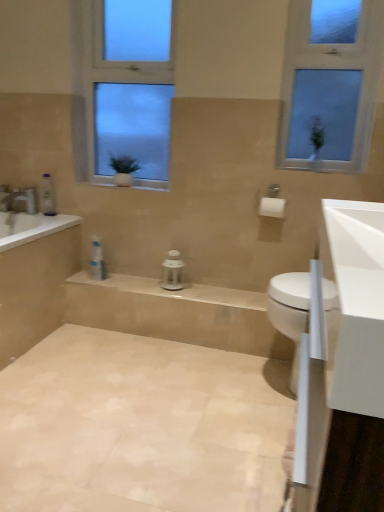
Question: Which is correct: white matte toilet paper at upper center is inside white glossy bathtub at left, or outside of it?

Choices:
 (A) inside
 (B) outside

Answer: (B)

Question: Is white matte toilet paper at upper center bigger or smaller than white glossy bathtub at left?

Choices:
 (A) big
 (B) small

Answer: (B)

Question: Estimate the real-world distances between objects in this image. Which object is farther from the clear glass window at center, acting as the 1th window starting from the left?

Choices:
 (A) clear plastic bottle at left, the first toiletry in the top-to-bottom sequence
 (B) beige tile bath at lower left
 (C) white glossy sink at right
 (D) clear glass window at upper right, the 1th window positioned from the right
 (E) white plastic toiletries at center, which ranks as the second toiletry in top-to-bottom order

Answer: (C)

Question: Which of these objects is positioned closest to the white plastic toiletries at center, positioned as the second toiletry in left-to-right order?

Choices:
 (A) beige tile bath at lower left
 (B) clear glass window at upper right, which is the second window from left to right
 (C) white matte toilet paper at upper center
 (D) clear glass window at center, acting as the 1th window starting from the left
 (E) clear plastic bottle at left, placed as the 2th toiletry when sorted from right to left

Answer: (A)